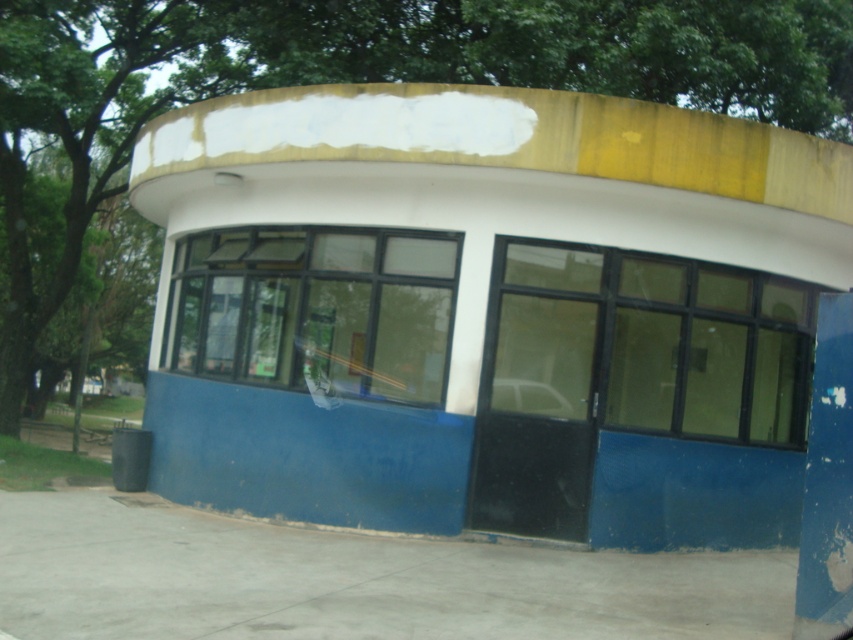
Question: From the image, what is the correct spatial relationship of clear glass window at center in relation to metallic silver car at center?

Choices:
 (A) left
 (B) right

Answer: (A)

Question: Based on their relative distances, which object is farther from the transparent glass window at center?

Choices:
 (A) metallic silver car at center
 (B) clear glass window at center

Answer: (B)

Question: Which of the following is the closest to the observer?

Choices:
 (A) (538, 412)
 (B) (247, 260)

Answer: (A)

Question: Is clear glass window at center further to camera compared to metallic silver car at center?

Choices:
 (A) yes
 (B) no

Answer: (A)

Question: Which of these objects is positioned closest to the metallic silver car at center?

Choices:
 (A) transparent glass window at center
 (B) clear glass window at center

Answer: (A)

Question: Observing the image, what is the correct spatial positioning of clear glass window at center in reference to metallic silver car at center?

Choices:
 (A) left
 (B) right

Answer: (A)